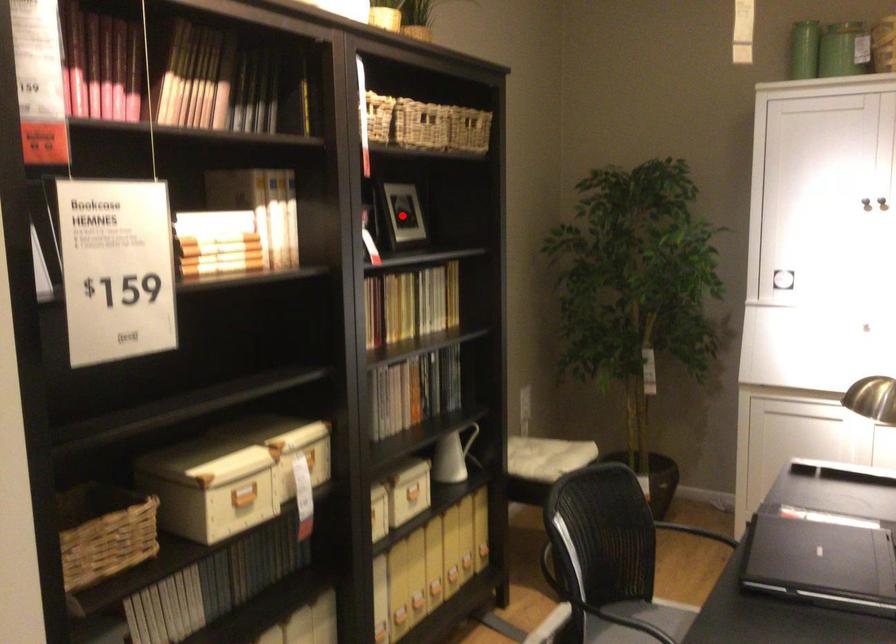
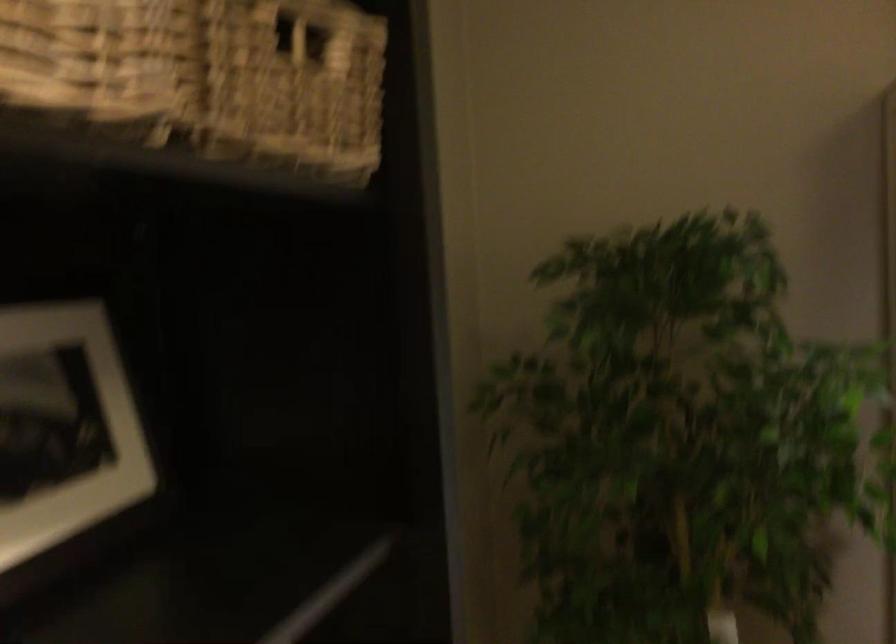
Locate, in the second image, the point that corresponds to the highlighted location in the first image.

(64, 427)